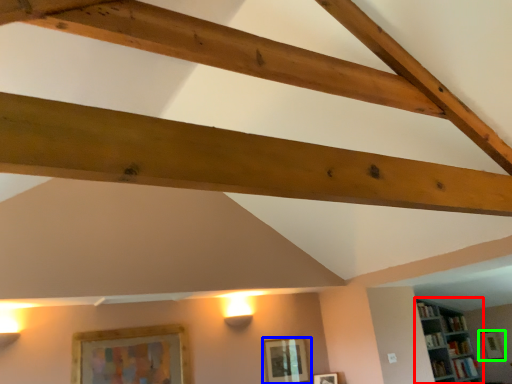
Question: Which object is the closest to the shelf (highlighted by a red box)? Choose among these: picture frame (highlighted by a blue box) or picture frame (highlighted by a green box).

Choices:
 (A) picture frame
 (B) picture frame

Answer: (B)